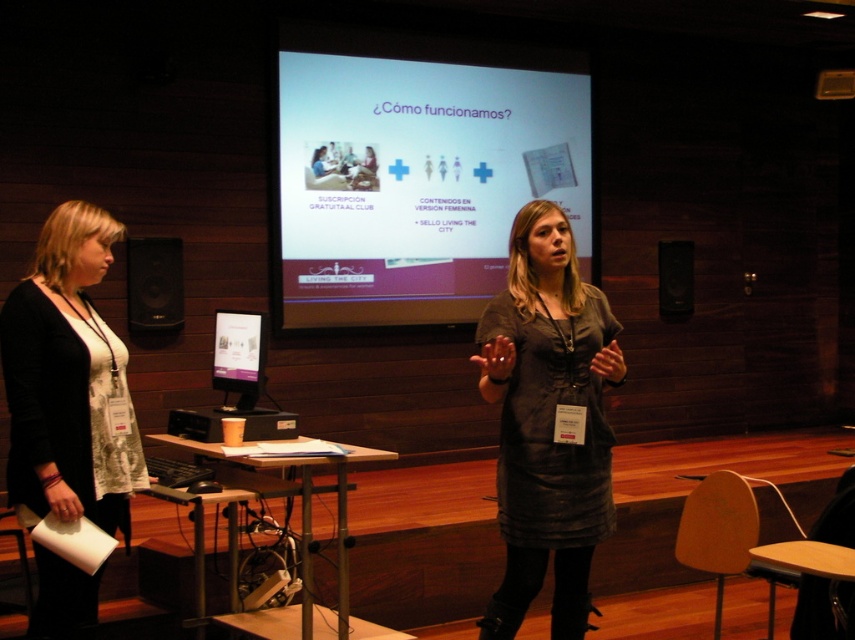
Question: Is white matte projection screen at center to the left of black matte speaker at right from the viewer's perspective?

Choices:
 (A) yes
 (B) no

Answer: (A)

Question: Considering the real-world distances, which object is closest to the dark gray dress at center?

Choices:
 (A) matte plastic screen at center
 (B) white printed dress at left
 (C) black plastic projector at center
 (D) black matte speaker at right

Answer: (C)

Question: In this image, where is white matte projection screen at center located relative to matte black speaker at left?

Choices:
 (A) left
 (B) right

Answer: (B)

Question: Does white matte projection screen at center have a larger size compared to matte black speaker at left?

Choices:
 (A) yes
 (B) no

Answer: (A)

Question: Which point appears farthest from the camera in this image?

Choices:
 (A) (217, 376)
 (B) (422, 230)
 (C) (190, 435)

Answer: (B)

Question: Among these points, which one is nearest to the camera?

Choices:
 (A) (69, 371)
 (B) (240, 323)
 (C) (284, 413)

Answer: (A)